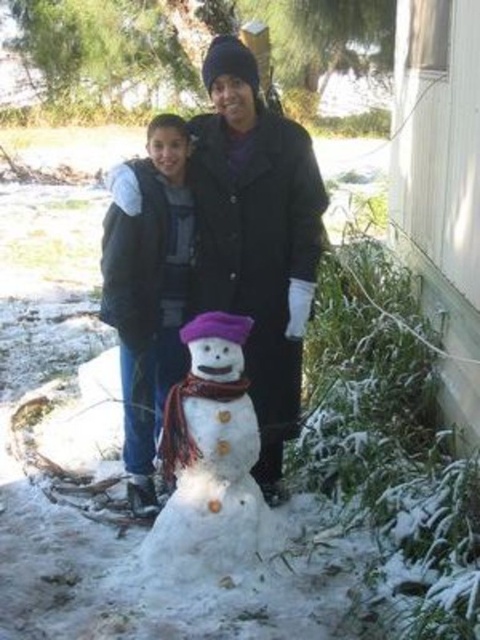
Question: Which of the following is the farthest from the observer?

Choices:
 (A) (312, 204)
 (B) (212, 513)
 (C) (179, 312)

Answer: (C)

Question: Does white matte snowman at center have a lesser width compared to white fluffy snowman at center?

Choices:
 (A) yes
 (B) no

Answer: (B)

Question: From the image, what is the correct spatial relationship of matte black coat at center in relation to white fluffy snowman at center?

Choices:
 (A) right
 (B) left

Answer: (B)

Question: Which of the following is the farthest from the observer?

Choices:
 (A) (261, 508)
 (B) (204, 294)

Answer: (B)

Question: Does white matte snowman at center have a greater width compared to white fluffy snowman at center?

Choices:
 (A) no
 (B) yes

Answer: (B)

Question: Which of these objects is positioned closest to the white fluffy snowman at center?

Choices:
 (A) white matte snowman at center
 (B) matte black coat at center

Answer: (B)